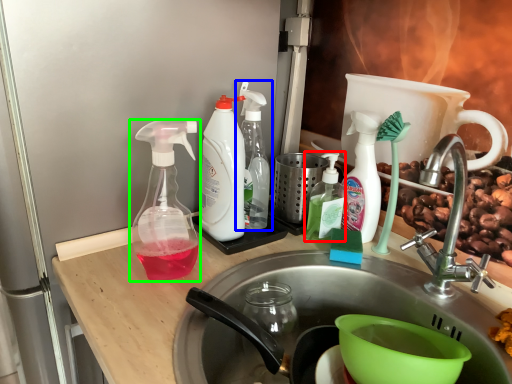
Question: Considering the real-world distances, which object is farthest from bottle (highlighted by a red box)? bottle (highlighted by a blue box) or bottle (highlighted by a green box)?

Choices:
 (A) bottle
 (B) bottle

Answer: (B)